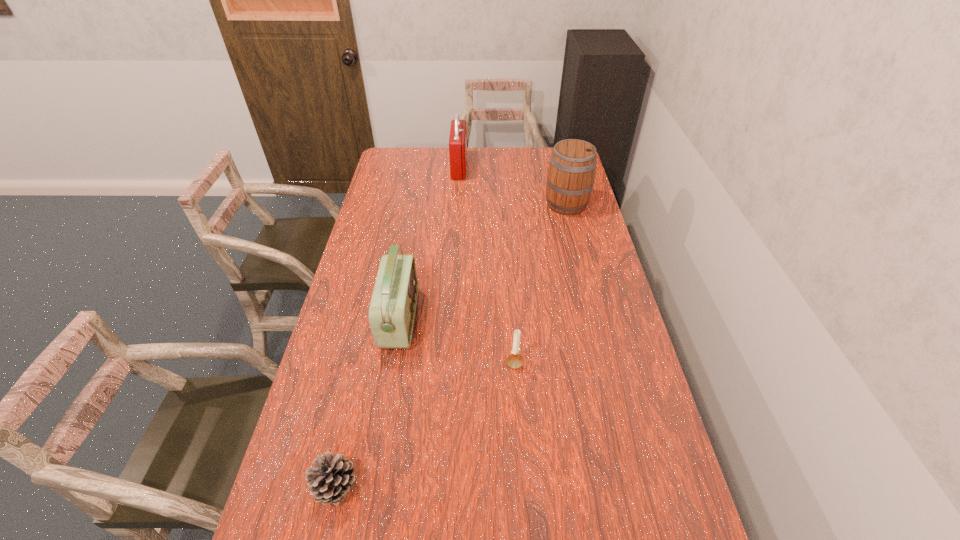
This screenshot has height=540, width=960. What are the coordinates of `the third object from right to left` in the screenshot? It's located at (457, 140).

At what (x,y) coordinates should I click in order to perform the action: click on the farthest object. Please return your answer as a coordinate pair (x, y). Looking at the image, I should click on (457, 140).

Locate an element on the screen. The image size is (960, 540). the rightmost object is located at coordinates (571, 174).

Image resolution: width=960 pixels, height=540 pixels. What are the coordinates of `the fourth nearest object` in the screenshot? It's located at (571, 174).

Where is `radio receiver`? radio receiver is located at coordinates (392, 308).

The height and width of the screenshot is (540, 960). In order to click on candle holder in this screenshot , I will do `click(514, 361)`.

The height and width of the screenshot is (540, 960). Identify the location of the second shortest object. (514, 361).

What are the coordinates of `the nearest object` in the screenshot? It's located at pos(330,479).

You are a GUI agent. You are given a task and a screenshot of the screen. Output one action in this format:
    pyautogui.click(x=<x>, y=<y>)
    Task: Click on the shortest object
    Image resolution: width=960 pixels, height=540 pixels.
    Given the screenshot: What is the action you would take?
    pyautogui.click(x=330, y=479)

The height and width of the screenshot is (540, 960). What are the coordinates of `free point located on the front face of the first-aid kit` in the screenshot? It's located at (479, 168).